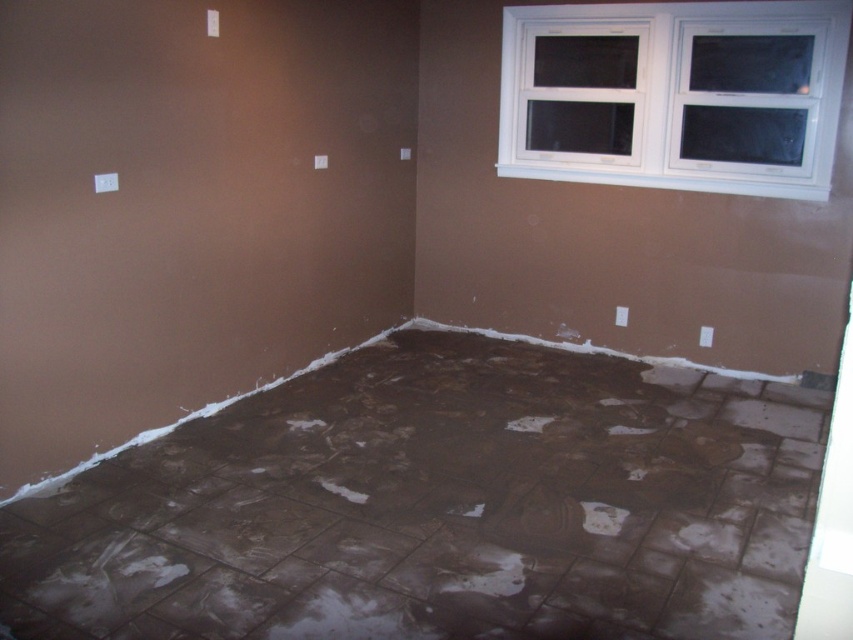
Question: Among these objects, which one is farthest from the camera?

Choices:
 (A) white plastic window at upper right
 (B) brown matte tile floor at center

Answer: (A)

Question: Is brown matte tile floor at center positioned before white plastic window at upper right?

Choices:
 (A) no
 (B) yes

Answer: (B)

Question: Is brown matte tile floor at center above white plastic window at upper right?

Choices:
 (A) no
 (B) yes

Answer: (A)

Question: Can you confirm if brown matte tile floor at center is smaller than white plastic window at upper right?

Choices:
 (A) yes
 (B) no

Answer: (B)

Question: Which point is farther from the camera taking this photo?

Choices:
 (A) (608, 45)
 (B) (607, 563)

Answer: (A)